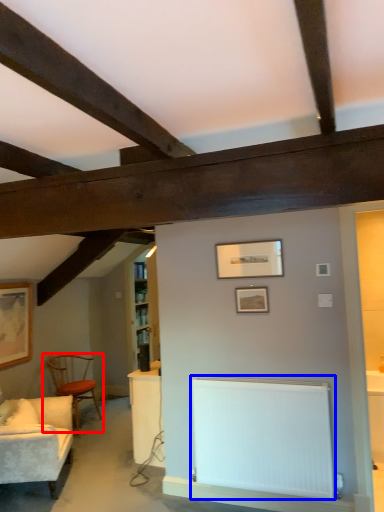
Question: Which of the following is the closest to the observer, chair (highlighted by a red box) or radiator (highlighted by a blue box)?

Choices:
 (A) chair
 (B) radiator

Answer: (B)